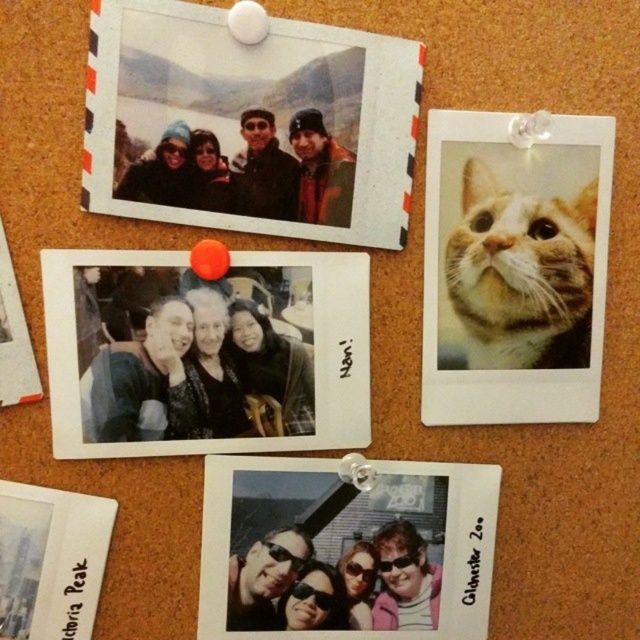
You are standing in front of a corkboard with two points marked. The first point is at coordinate point (264, 48) and the second is at point (275, 288). Which point is closer to you?

Point (264, 48) is closer to the viewer than point (275, 288).

You are standing at point (182, 280) and want to take a photo of the camera. Is the camera within your reach?

The point (182, 280) and camera are 23.97 inches apart, so the camera is within your reach if you can extend your arm 23.97 inches.

You are organizing a photo album and want to place the matte black photo at center and the matte plastic photo at bottom center in order from closest to farthest from the viewer. Which should come first?

The matte black photo at center should come first in the order since it is positioned in front of the matte plastic photo at bottom center, making it closer to the viewer.